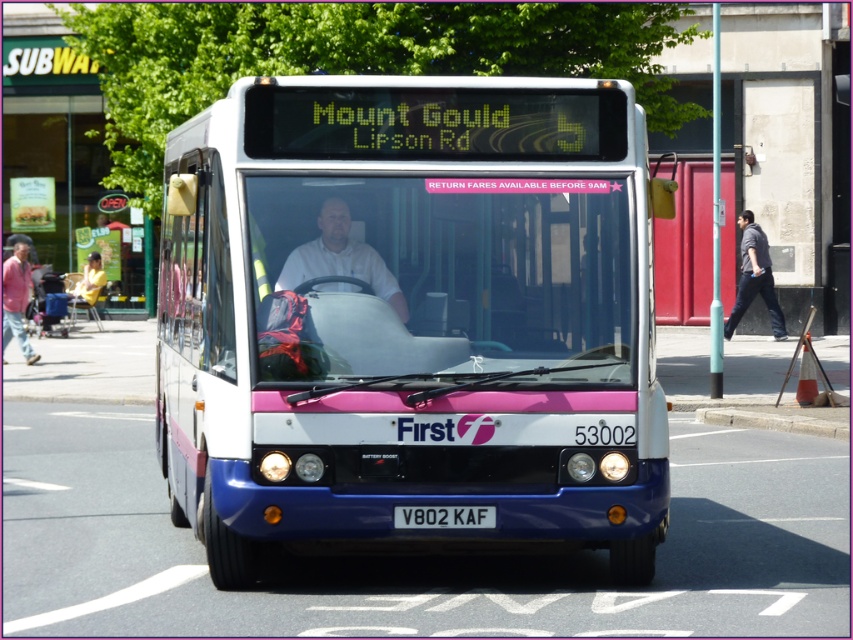
Question: Which point appears closest to the camera in this image?

Choices:
 (A) (579, 346)
 (B) (318, 236)

Answer: (B)

Question: Estimate the real-world distances between objects in this image. Which object is closer to the matte pink jacket at left?

Choices:
 (A) white matte shirt at center
 (B) matte white bus at center
 (C) white rectangular license plate at center
 (D) gray concrete curb at lower center

Answer: (D)

Question: Which object is closer to the camera taking this photo?

Choices:
 (A) dark gray shirt at right
 (B) white rectangular license plate at center
 (C) white matte shirt at center
 (D) gray concrete curb at lower center

Answer: (B)

Question: Does white matte shirt at center have a larger size compared to matte pink jacket at left?

Choices:
 (A) no
 (B) yes

Answer: (A)

Question: Does matte white bus at center have a greater width compared to gray concrete curb at lower center?

Choices:
 (A) no
 (B) yes

Answer: (B)

Question: In this image, where is gray concrete curb at lower center located relative to white rectangular license plate at center?

Choices:
 (A) right
 (B) left

Answer: (A)